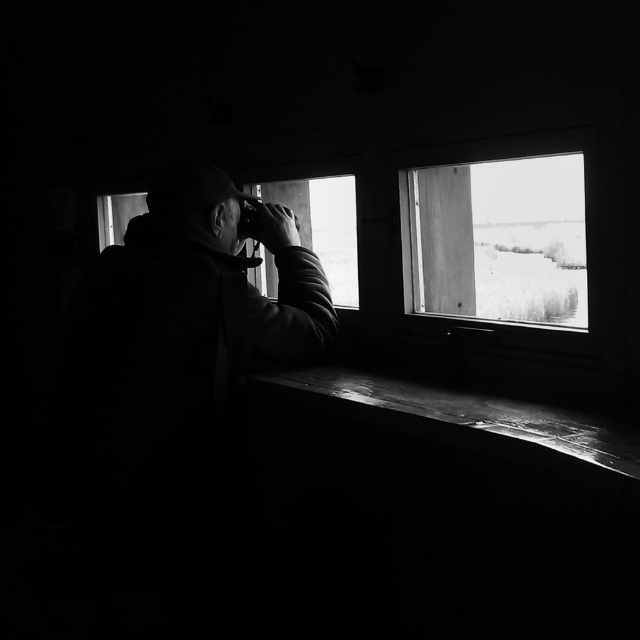
You are standing in the dimly lit structure and want to place a small notebook on the smooth wood window sill at lower center. Based on the image, can you determine the exact coordinates where you should place it?

The smooth wood window sill at lower center is located at coordinates point (477, 422), so place the notebook there.

You are a person who is 1.7 meters tall and want to see outside through the clear glass window at upper right. The window is divided into two sections. Can you stand on the existing bench in the hide to see through both sections of the window?

The two sections of the window are 1.49 meters apart. Since you are 1.7 meters tall, standing on the bench would allow you to reach and see through both sections of the window.

You are a visitor at a wildlife sanctuary and need to place a small 12 inch wide bird guidebook on the structure between the smooth wood window sill at lower center and the transparent glass window at center. Can the book fit there?

The smooth wood window sill at lower center and transparent glass window at center are 37.31 inches apart, so the 12 inch wide bird guidebook can fit between them.